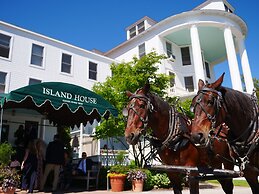
The width and height of the screenshot is (259, 194). I want to click on window, so click(91, 74).